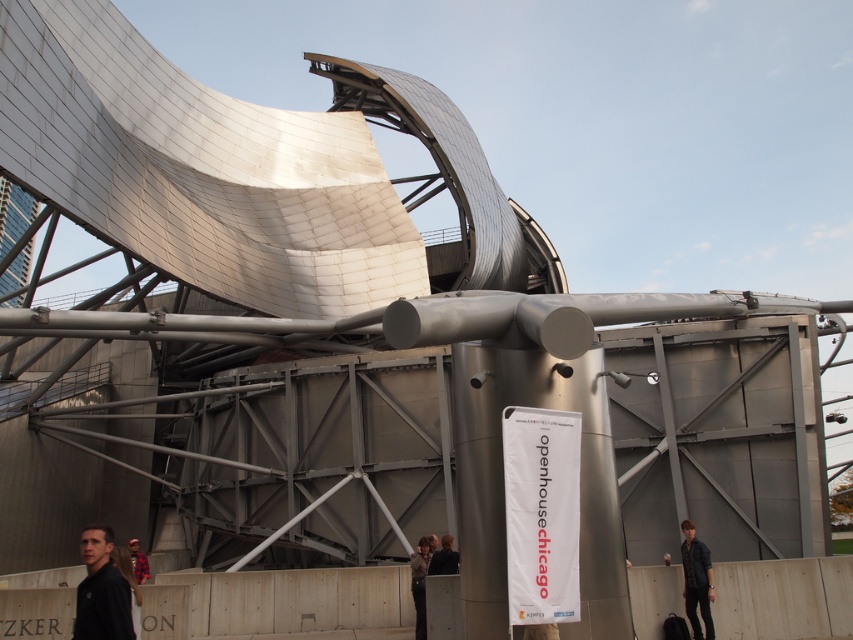
Does denim jacket at lower right have a greater height compared to dark gray fabric jacket at lower center?

Yes.

The width and height of the screenshot is (853, 640). In order to click on denim jacket at lower right in this screenshot , I will do click(x=695, y=580).

Does denim jacket at lower right have a larger size compared to red plaid shirt at lower left?

No, denim jacket at lower right is not bigger than red plaid shirt at lower left.

Looking at this image, who is taller, denim jacket at lower right or red plaid shirt at lower left?

With more height is red plaid shirt at lower left.

Is point (694, 563) farther from viewer compared to point (131, 538)?

No, (694, 563) is closer to viewer.

Where is `denim jacket at lower right`? The height and width of the screenshot is (640, 853). denim jacket at lower right is located at coordinates (695, 580).

Who is lower down, dark brown hair at center or red plaid shirt at lower left?

red plaid shirt at lower left is below.

Is point (451, 561) less distant than point (143, 577)?

Yes, it is.

The width and height of the screenshot is (853, 640). Identify the location of dark brown hair at center. (444, 557).